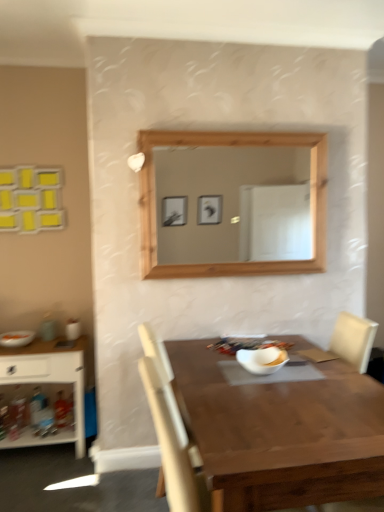
You are a GUI agent. You are given a task and a screenshot of the screen. Output one action in this format:
    pyautogui.click(x=<x>, y=<y>)
    Task: Click on the free space in front of white glossy bowl at center
    This screenshot has height=512, width=384.
    Given the screenshot: What is the action you would take?
    pyautogui.click(x=271, y=390)